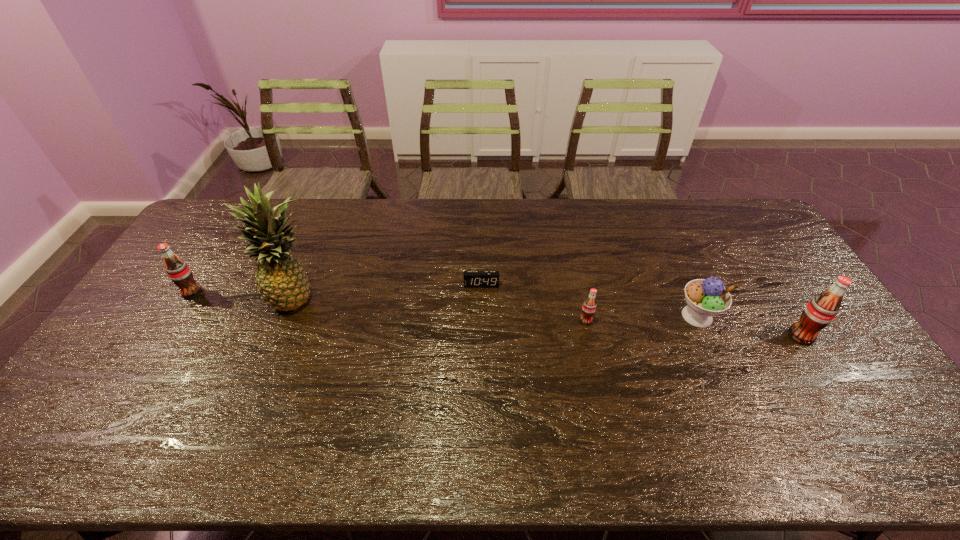
At what (x,y) coordinates should I click in order to perform the action: click on the third object from left to right. Please return your answer as a coordinate pair (x, y). The width and height of the screenshot is (960, 540). Looking at the image, I should click on (472, 279).

Image resolution: width=960 pixels, height=540 pixels. In order to click on the shortest object in this screenshot , I will do `click(472, 279)`.

Identify the location of free location located 0.390m on the back of the farthest soda. (243, 212).

The image size is (960, 540). In order to click on vacant space positioned on the back of the second farthest soda in this screenshot , I will do 576,276.

Find the location of a particular element. This screenshot has width=960, height=540. vacant point located on the left of the rightmost object is located at coordinates (747, 336).

Where is `vacant region located 0.050m on the back of the icecream`? vacant region located 0.050m on the back of the icecream is located at coordinates (684, 289).

This screenshot has width=960, height=540. In order to click on free space located on the right of the pineapple in this screenshot , I will do `click(340, 297)`.

Where is `vacant space located 0.140m on the front-facing side of the alarm clock`? vacant space located 0.140m on the front-facing side of the alarm clock is located at coordinates (481, 322).

The height and width of the screenshot is (540, 960). Identify the location of object located at the left edge. (178, 271).

In order to click on object that is at the right edge in this screenshot , I will do `click(821, 310)`.